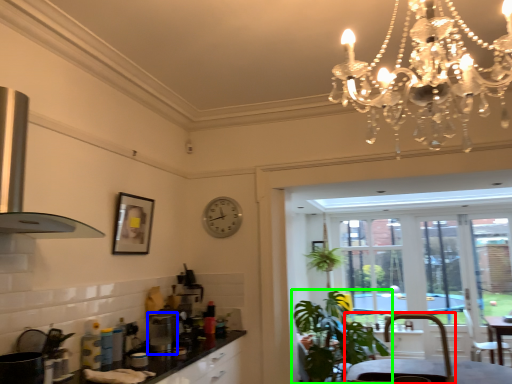
Question: Based on their relative distances, which object is farther from armchair (highlighted by a red box)? Choose from appliance (highlighted by a blue box) and houseplant (highlighted by a green box).

Choices:
 (A) appliance
 (B) houseplant

Answer: (A)